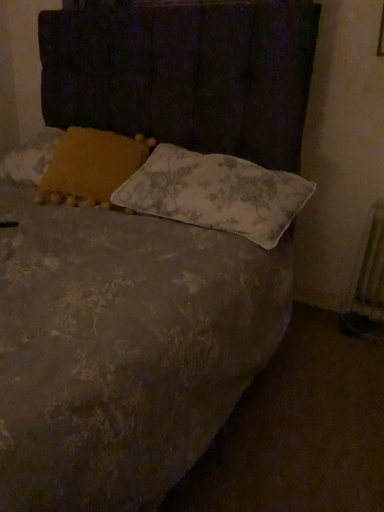
Question: Considering the relative sizes of floral-patterned fabric pillow at center, which appears as the first pillow when viewed from the right, and metallic silver radiator at right in the image provided, is floral-patterned fabric pillow at center, which appears as the first pillow when viewed from the right, smaller than metallic silver radiator at right?

Choices:
 (A) no
 (B) yes

Answer: (A)

Question: Can you confirm if floral-patterned fabric pillow at center, which appears as the first pillow when viewed from the right, is thinner than metallic silver radiator at right?

Choices:
 (A) yes
 (B) no

Answer: (B)

Question: Considering the relative sizes of floral-patterned fabric pillow at center, which appears as the first pillow when viewed from the right, and metallic silver radiator at right in the image provided, is floral-patterned fabric pillow at center, which appears as the first pillow when viewed from the right, taller than metallic silver radiator at right?

Choices:
 (A) no
 (B) yes

Answer: (A)

Question: Can you confirm if floral-patterned fabric pillow at center, which appears as the first pillow when viewed from the right, is bigger than metallic silver radiator at right?

Choices:
 (A) yes
 (B) no

Answer: (A)

Question: Does floral-patterned fabric pillow at center, which is the 2th pillow from left to right, turn towards metallic silver radiator at right?

Choices:
 (A) no
 (B) yes

Answer: (A)

Question: Is floral-patterned fabric pillow at center, which is the 2th pillow from left to right, inside the boundaries of metallic silver radiator at right, or outside?

Choices:
 (A) inside
 (B) outside

Answer: (B)

Question: From a real-world perspective, relative to metallic silver radiator at right, is floral-patterned fabric pillow at center, which is the 2th pillow from left to right, vertically above or below?

Choices:
 (A) above
 (B) below

Answer: (A)

Question: In terms of height, does floral-patterned fabric pillow at center, which is the 2th pillow from left to right, look taller or shorter compared to metallic silver radiator at right?

Choices:
 (A) short
 (B) tall

Answer: (A)

Question: Considering the positions of floral-patterned fabric pillow at center, which is the 2th pillow from left to right, and metallic silver radiator at right in the image, is floral-patterned fabric pillow at center, which is the 2th pillow from left to right, bigger or smaller than metallic silver radiator at right?

Choices:
 (A) big
 (B) small

Answer: (A)

Question: Considering their positions, is metallic silver radiator at right located in front of or behind yellow fabric pillow at upper left, the 2th pillow when ordered from right to left?

Choices:
 (A) front
 (B) behind

Answer: (B)

Question: Considering the positions of metallic silver radiator at right and yellow fabric pillow at upper left, the 2th pillow when ordered from right to left, in the image, is metallic silver radiator at right taller or shorter than yellow fabric pillow at upper left, the 2th pillow when ordered from right to left,?

Choices:
 (A) short
 (B) tall

Answer: (B)

Question: From a real-world perspective, is metallic silver radiator at right positioned above or below yellow fabric pillow at upper left, the 1th pillow positioned from the left?

Choices:
 (A) below
 (B) above

Answer: (A)

Question: Considering the positions of metallic silver radiator at right and yellow fabric pillow at upper left, the 2th pillow when ordered from right to left, in the image, is metallic silver radiator at right bigger or smaller than yellow fabric pillow at upper left, the 2th pillow when ordered from right to left,?

Choices:
 (A) small
 (B) big

Answer: (A)

Question: Is yellow fabric pillow at upper left, the 1th pillow positioned from the left, in front of or behind metallic silver radiator at right in the image?

Choices:
 (A) front
 (B) behind

Answer: (A)

Question: From the image's perspective, is yellow fabric pillow at upper left, the 1th pillow positioned from the left, positioned above or below metallic silver radiator at right?

Choices:
 (A) below
 (B) above

Answer: (B)